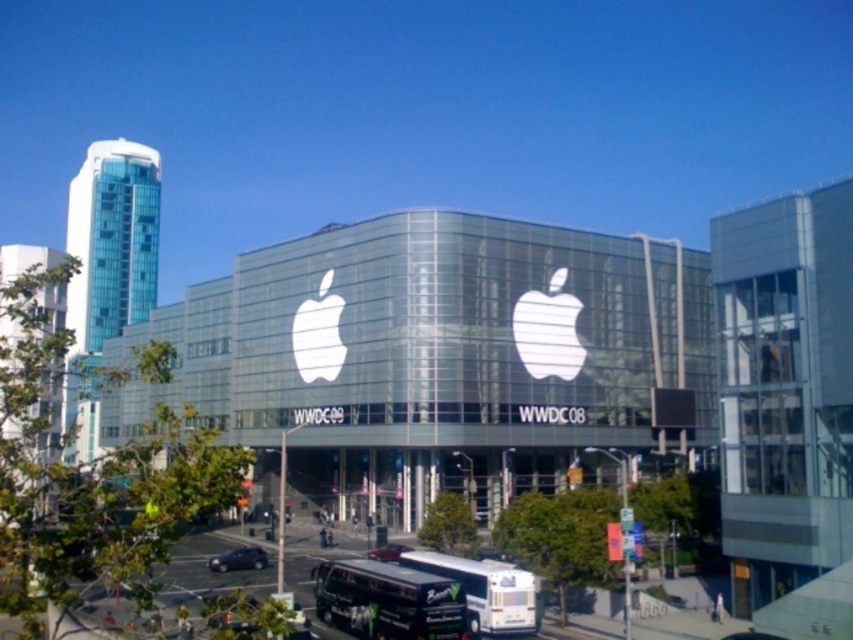
Question: Which is nearer to the shiny black car at lower center?

Choices:
 (A) black matte bus at lower center
 (B) shiny black sedan at center

Answer: (B)

Question: Where is black matte bus at lower center located in relation to shiny black sedan at center in the image?

Choices:
 (A) below
 (B) above

Answer: (B)

Question: Does shiny black car at lower center have a greater width compared to shiny black sedan at center?

Choices:
 (A) no
 (B) yes

Answer: (B)

Question: Which of the following is the closest to the observer?

Choices:
 (A) (526, 595)
 (B) (248, 568)
 (C) (393, 566)

Answer: (A)

Question: Can you confirm if shiny black car at lower center is positioned below shiny black sedan at center?

Choices:
 (A) yes
 (B) no

Answer: (A)

Question: Considering the real-world distances, which object is farthest from the white glossy bus at lower center?

Choices:
 (A) shiny black sedan at center
 (B) black matte bus at lower center

Answer: (A)